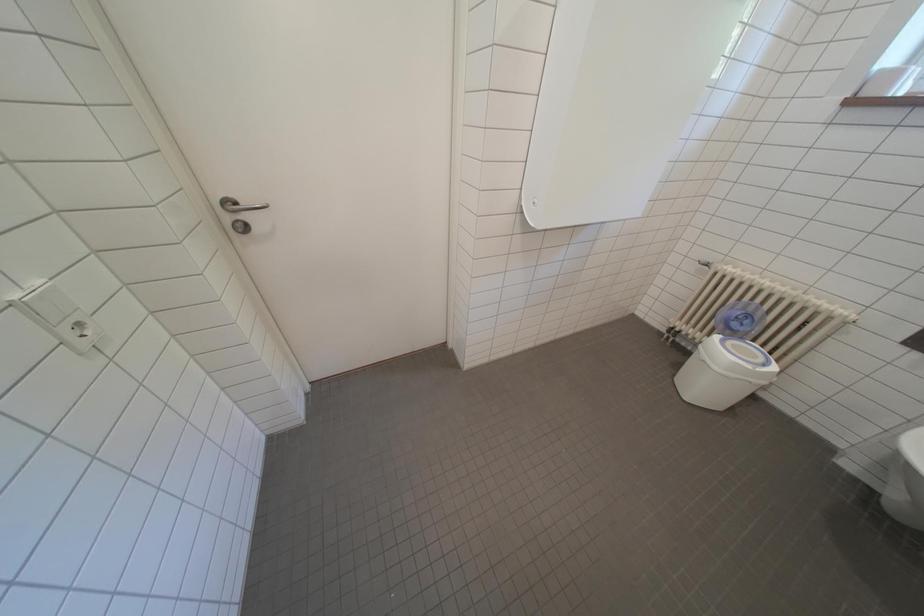
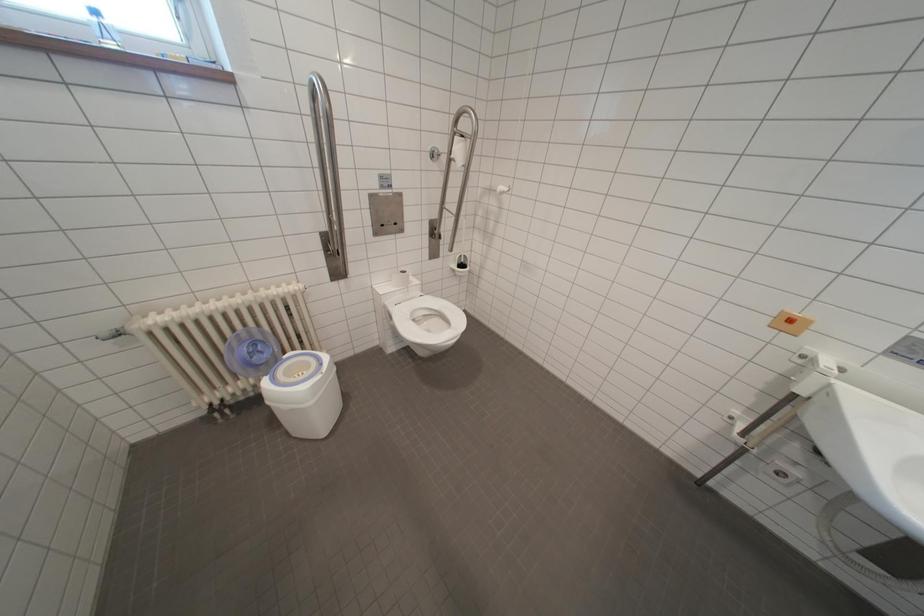
First-person continuous shooting, in which direction is the camera rotating?

The rotation direction of the camera is right-down.